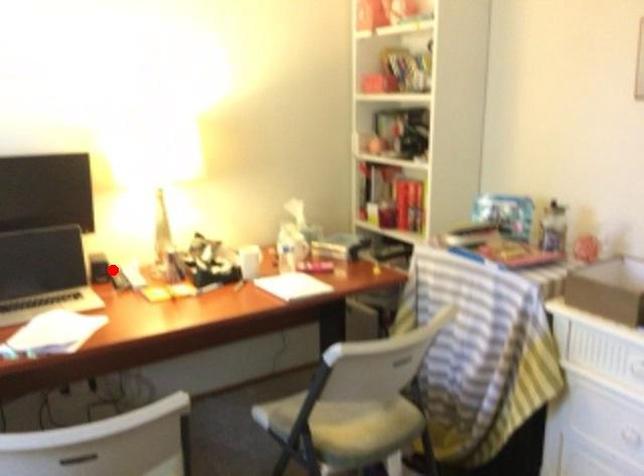
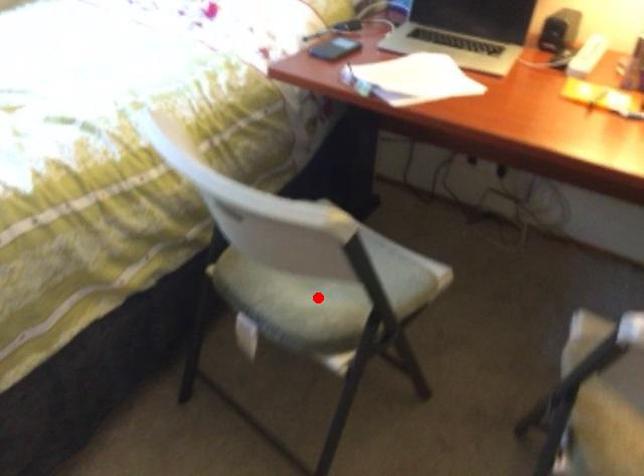
I am providing you with two images of the same scene from different viewpoints. A red point is marked on the first image and another point is marked on the second image. Does the point marked in image1 correspond to the same location as the one in image2?

No